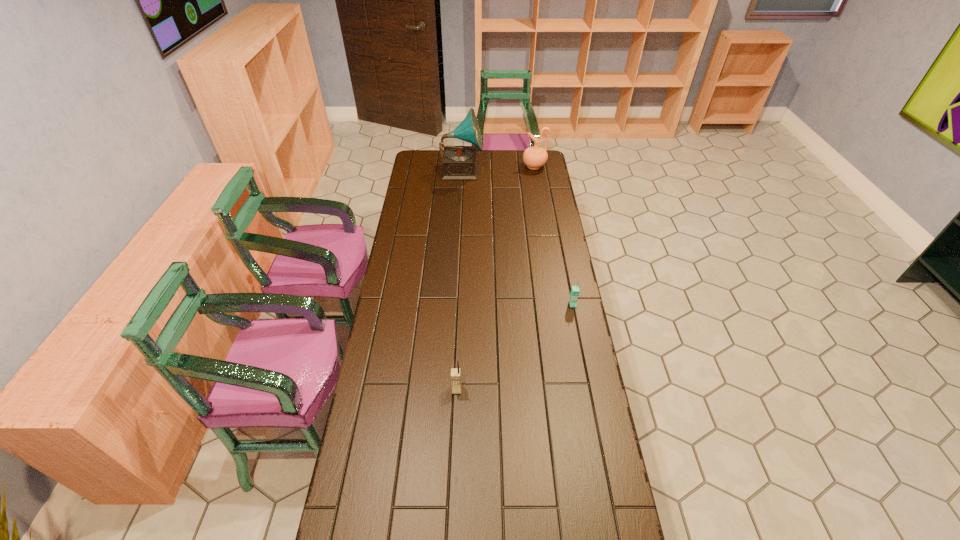
Identify the location of the third closest object relative to the shorter cellular telephone. (535, 157).

This screenshot has height=540, width=960. I want to click on the third closest object to the nearest object, so click(535, 157).

This screenshot has width=960, height=540. In order to click on free space that satisfies the following two spatial constraints: 1. on the spout of the second tallest object; 2. on the front of the nearer cellular telephone, where the keypad is located in this screenshot , I will do pos(571,390).

Identify the location of vacant point that satisfies the following two spatial constraints: 1. on the spout of the pottery; 2. on the front of the nearer cellular telephone, where the keypad is located. The height and width of the screenshot is (540, 960). (571, 390).